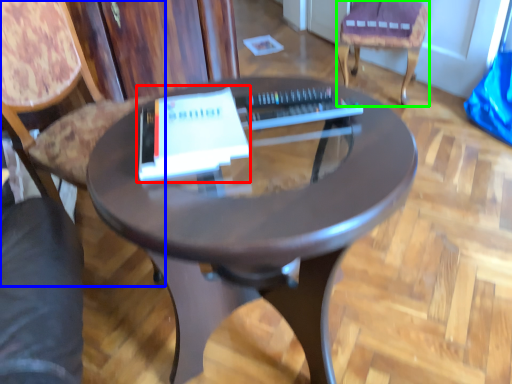
Question: Which object is positioned farthest from paperback book (highlighted by a red box)? Select from chair (highlighted by a blue box) and chair (highlighted by a green box).

Choices:
 (A) chair
 (B) chair

Answer: (B)